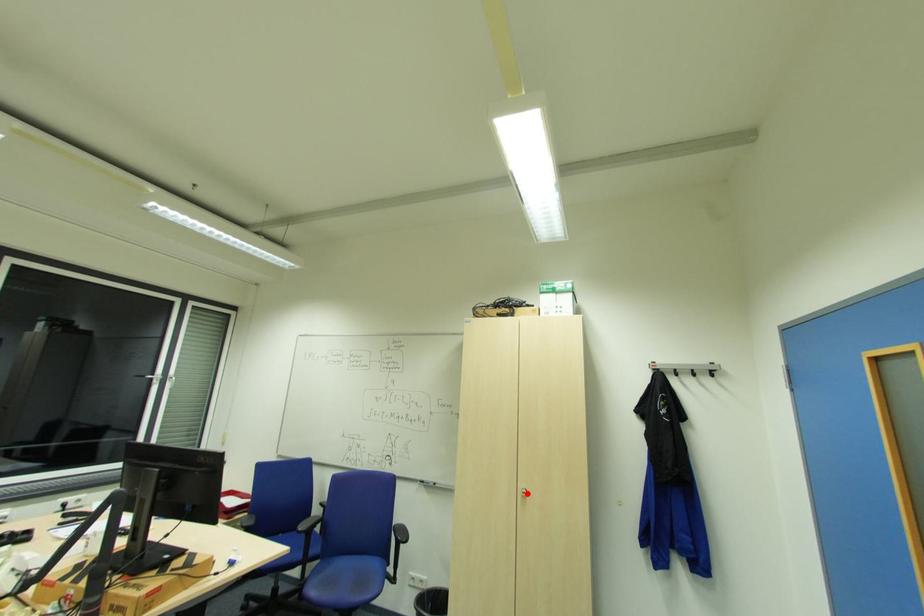
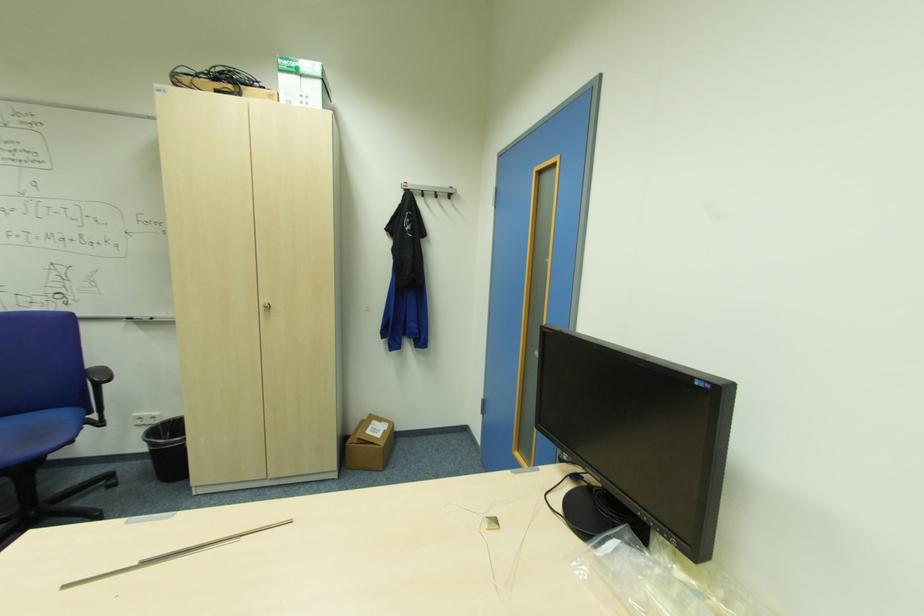
Locate, in the second image, the point that corresponds to the highlighted location in the first image.

(271, 307)